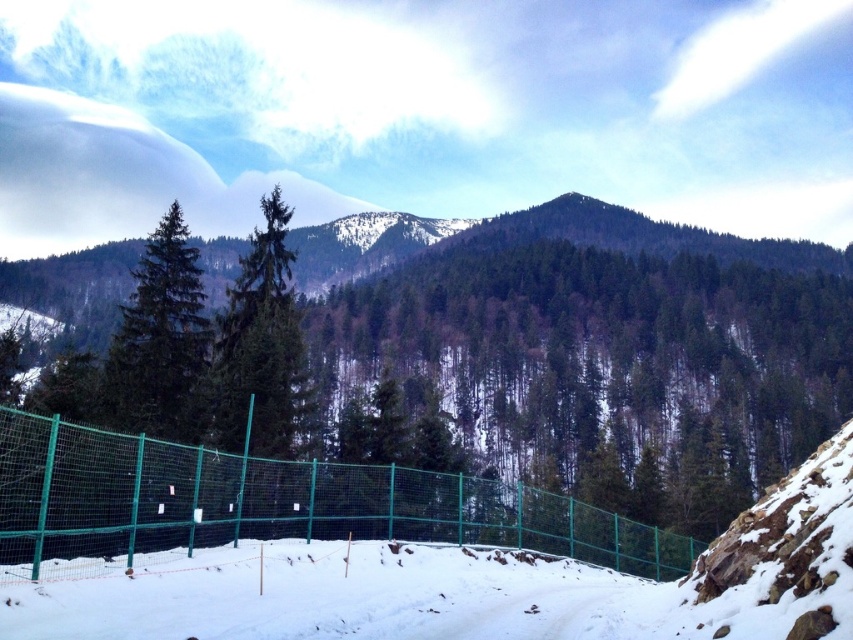
Question: Does green wire mesh fence at center appear under white snow ski slope at lower center?

Choices:
 (A) no
 (B) yes

Answer: (A)

Question: Does green wire mesh fence at center appear over white snow ski slope at lower center?

Choices:
 (A) yes
 (B) no

Answer: (A)

Question: Estimate the real-world distances between objects in this image. Which object is farther from the green matte tree at center?

Choices:
 (A) white snow ski slope at lower center
 (B) green wire mesh fence at center
 (C) green mesh fence at lower left

Answer: (B)

Question: Which object appears farthest from the camera in this image?

Choices:
 (A) green wire mesh fence at center
 (B) green mesh fence at lower left
 (C) green matte tree at center
 (D) white snow ski slope at lower center

Answer: (C)

Question: Which of these objects is positioned closest to the green matte tree at center?

Choices:
 (A) white snow ski slope at lower center
 (B) green mesh fence at lower left
 (C) green wire mesh fence at center

Answer: (A)

Question: Is green mesh fence at lower left above green matte tree at center?

Choices:
 (A) yes
 (B) no

Answer: (B)